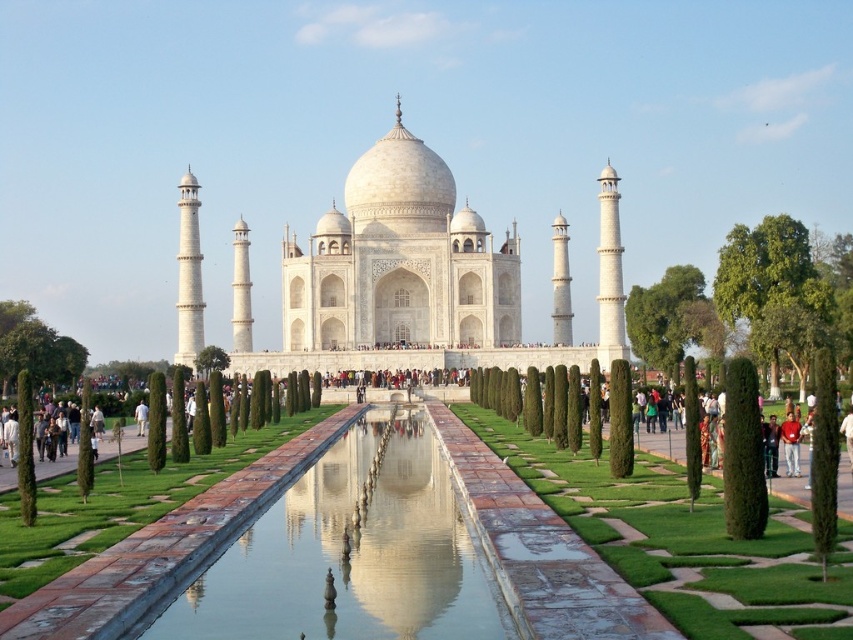
You are a tourist visiting the Taj Mahal and notice a red cotton shirt at center and clear glass water at center. Which object is wider? Please answer based on their widths.

The clear glass water at center is wider than the red cotton shirt at center.

You are a tourist standing at the entrance of the Taj Mahal complex. You want to take a photo that includes both the Taj Mahal and the green leafy tree at upper right. Given that your camera has a maximum zoom range of 100 meters, can you capture both in a single frame without moving your position?

The green leafy tree at upper right is 119.83 meters away from the camera. Since your camera can only zoom up to 100 meters, you cannot capture both the Taj Mahal and the green leafy tree at upper right in a single frame without moving your position.